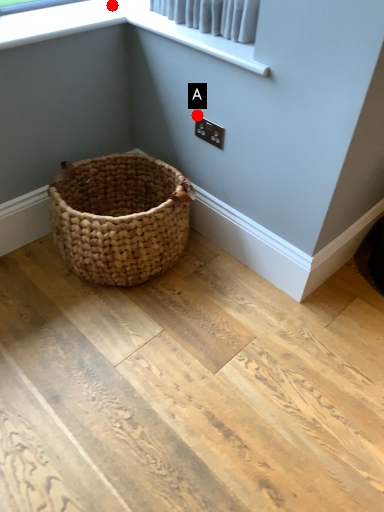
Question: Two points are circled on the image, labeled by A and B beside each circle. Which point is further to the camera?

Choices:
 (A) A is further
 (B) B is further

Answer: (A)